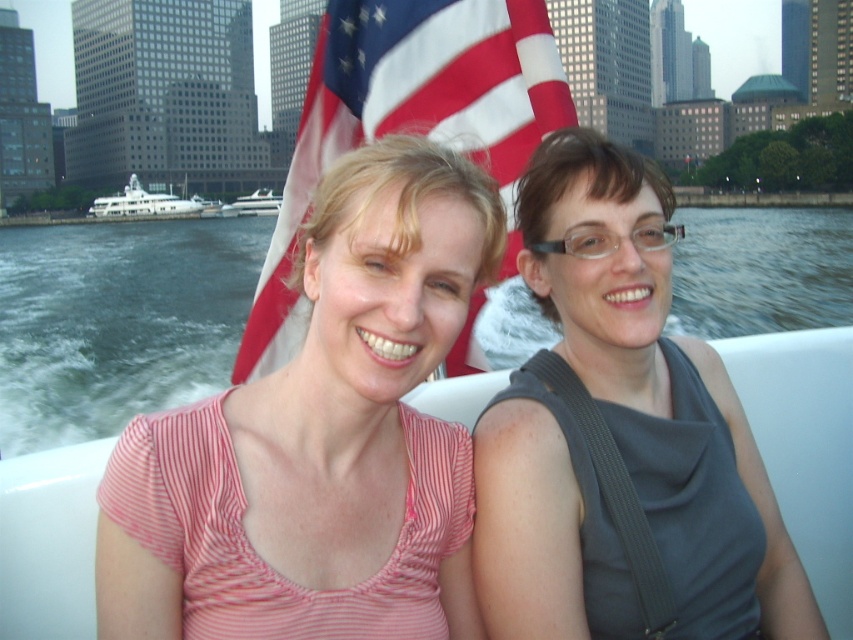
Does clear water at boat right appear on the left side of white glossy yacht at left?

Incorrect, clear water at boat right is not on the left side of white glossy yacht at left.

Can you confirm if clear water at boat right is positioned below white glossy yacht at left?

Correct, clear water at boat right is located below white glossy yacht at left.

Is point (131, 224) less distant than point (158, 211)?

No, (131, 224) is behind (158, 211).

Where is `clear water at boat right`? The image size is (853, 640). clear water at boat right is located at coordinates (117, 321).

In the scene shown: Between pink striped shirt at center and matte gray tank top at center, which one appears on the left side from the viewer's perspective?

Positioned to the left is pink striped shirt at center.

Is pink striped shirt at center bigger than matte gray tank top at center?

Incorrect, pink striped shirt at center is not larger than matte gray tank top at center.

Find the location of `pink striped shirt at center`. pink striped shirt at center is located at coordinates (320, 438).

Can you confirm if matte gray tank top at center is positioned to the left of white glossy yacht at left?

In fact, matte gray tank top at center is to the right of white glossy yacht at left.

Who is more distant from viewer, (633, 268) or (138, 212)?

Point (138, 212)

Find the location of `matte gray tank top at center`. matte gray tank top at center is located at coordinates (659, 387).